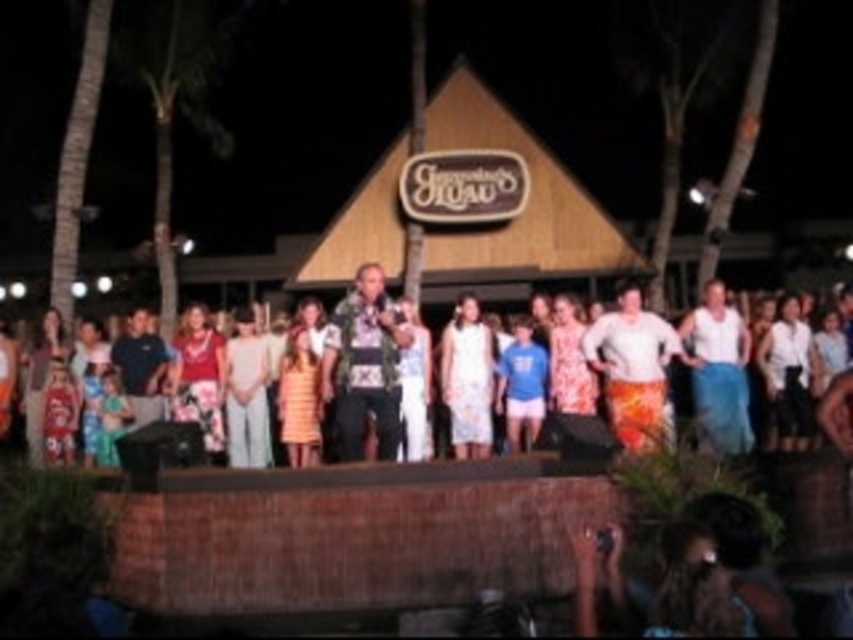
Question: Is camouflage fabric shirt at center wider than floral dress at center?

Choices:
 (A) no
 (B) yes

Answer: (A)

Question: Among these objects, which one is nearest to the camera?

Choices:
 (A) white woven fabric at center
 (B) camouflage fabric shirt at center
 (C) green leafy palm tree at left
 (D) floral dress at center

Answer: (A)

Question: Can you confirm if green leafy palm tree at left is positioned below camouflage fabric shirt at center?

Choices:
 (A) yes
 (B) no

Answer: (B)

Question: Is green leafy palm tree at left positioned at the back of camouflage fabric shirt at center?

Choices:
 (A) yes
 (B) no

Answer: (A)

Question: Which point is closer to the camera taking this photo?

Choices:
 (A) (381, 352)
 (B) (190, 38)

Answer: (A)

Question: Which object is positioned closest to the floral dress at center?

Choices:
 (A) white woven fabric at center
 (B) green leafy palm tree at left
 (C) camouflage fabric shirt at center

Answer: (A)